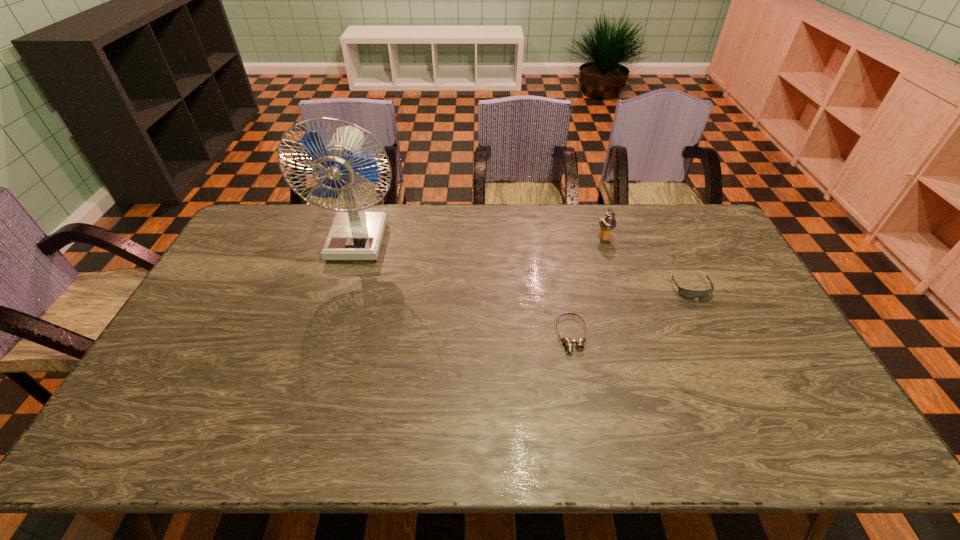
Locate an element on the screen. free location located 0.180m on the lenses of the third tallest object is located at coordinates [719, 349].

Where is `free space located on the front lenses and sides of the third object from right to left`? The width and height of the screenshot is (960, 540). free space located on the front lenses and sides of the third object from right to left is located at coordinates (593, 449).

I want to click on fan at the far edge, so click(x=355, y=235).

Image resolution: width=960 pixels, height=540 pixels. I want to click on icecream that is at the far edge, so click(x=607, y=223).

I want to click on object at the right edge, so click(x=686, y=293).

I want to click on vacant point at the far edge, so click(636, 230).

The image size is (960, 540). What are the coordinates of `free space at the near edge` in the screenshot? It's located at (216, 431).

Locate an element on the screen. vacant space at the left edge of the desktop is located at coordinates (157, 414).

Locate an element on the screen. vacant space at the right edge is located at coordinates (734, 350).

Locate an element on the screen. The image size is (960, 540). vacant space at the far right corner of the desktop is located at coordinates (704, 209).